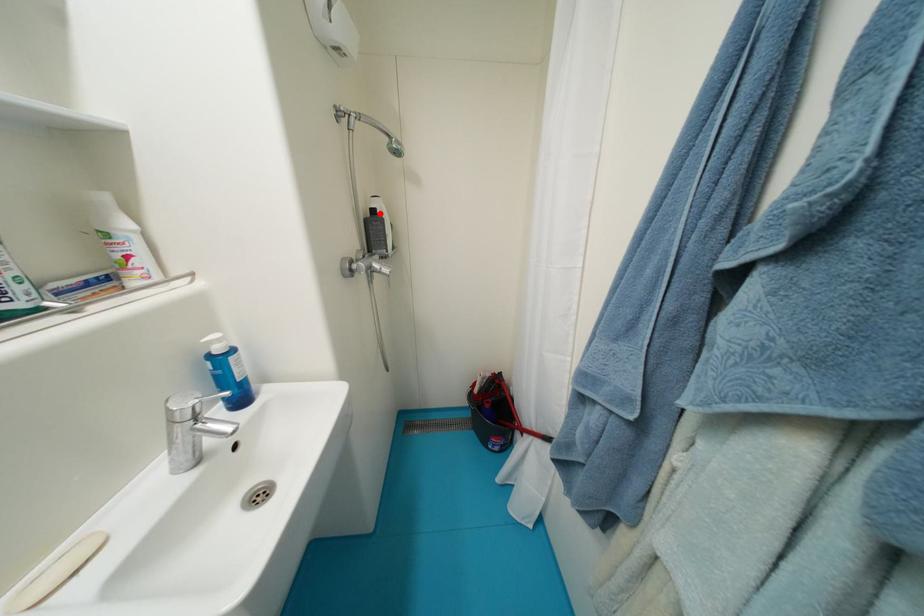
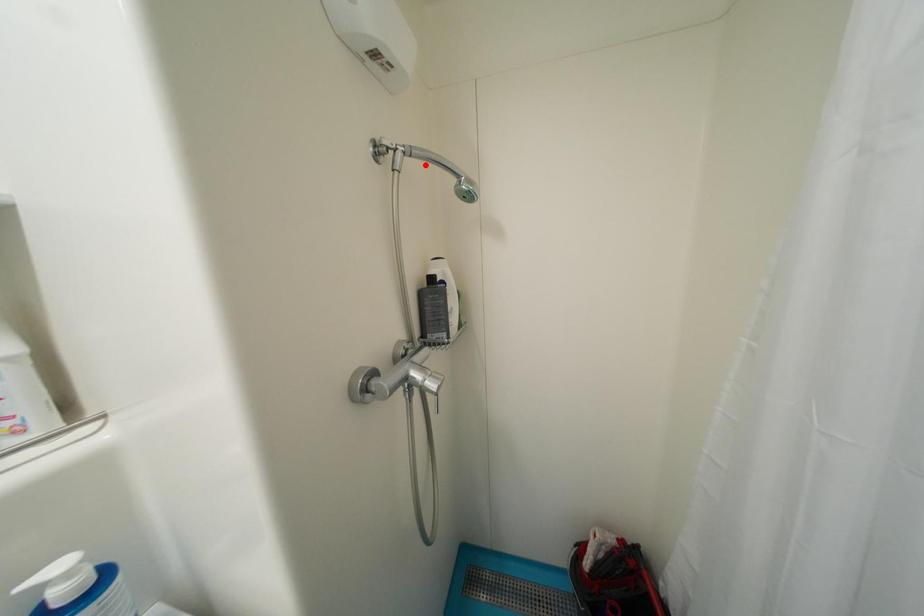
I am providing you with two images of the same scene from different viewpoints. A red point is marked on the first image and another point is marked on the second image. Are the points marked in image1 and image2 representing the same 3D position?

No